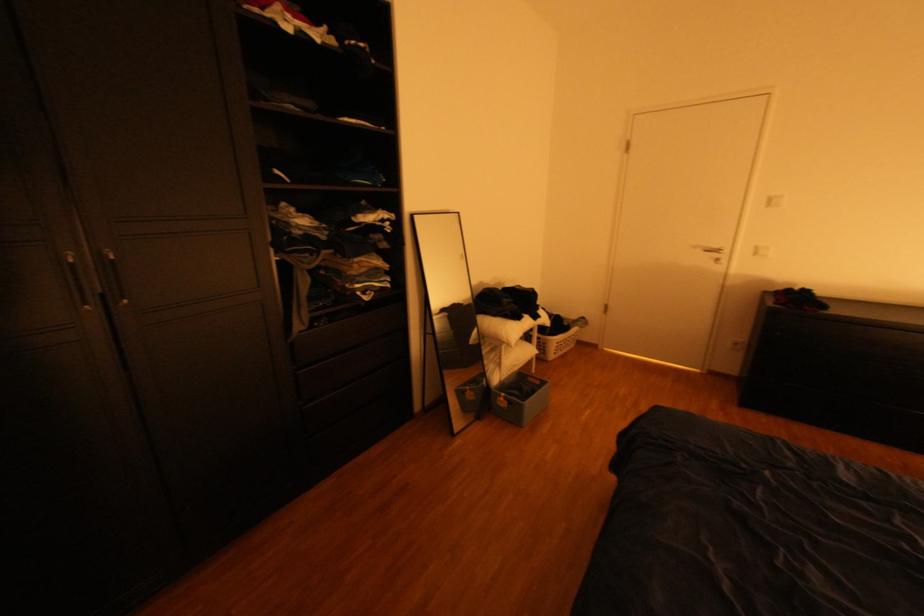
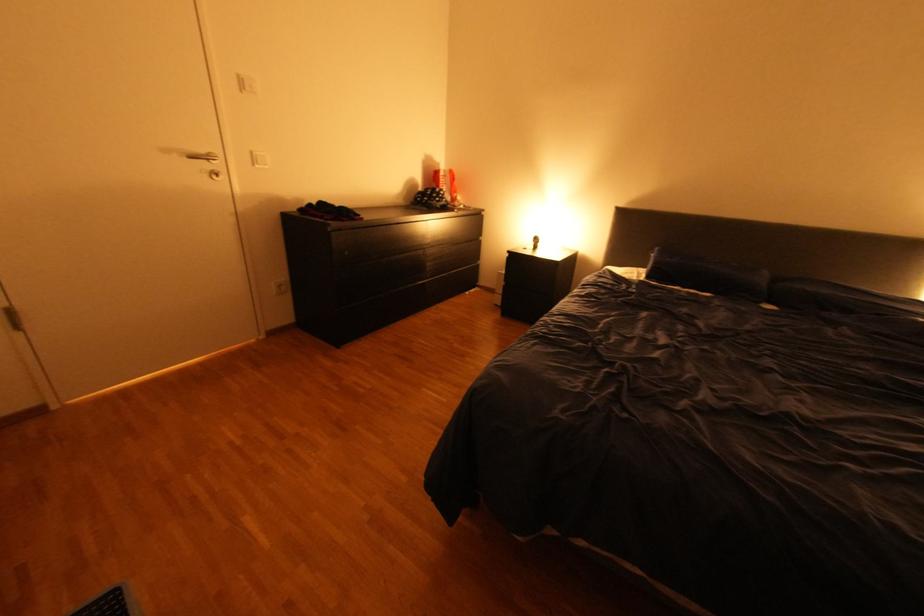
Find the pixel in the second image that matches [787,334] in the first image.

(357, 253)